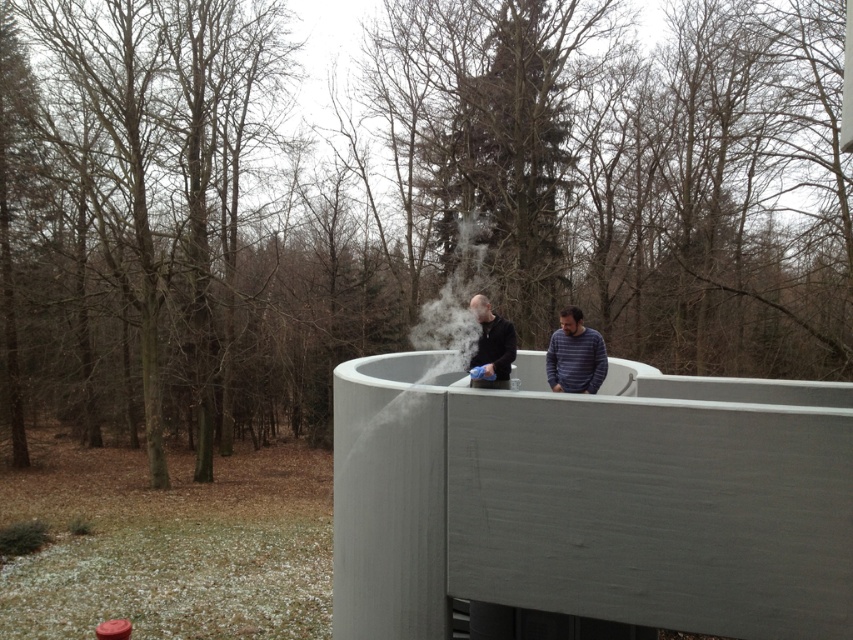
Question: Among these objects, which one is nearest to the camera?

Choices:
 (A) brown leafless tree at left
 (B) striped cotton shirt at center

Answer: (B)

Question: Which point is closer to the camera taking this photo?

Choices:
 (A) (498, 333)
 (B) (595, 346)
 (C) (460, 250)

Answer: (A)

Question: Does matte black clothing at center appear under striped cotton shirt at center?

Choices:
 (A) yes
 (B) no

Answer: (B)

Question: Does striped cotton shirt at center have a greater width compared to matte black jacket at center?

Choices:
 (A) no
 (B) yes

Answer: (B)

Question: Which object is closer to the camera taking this photo?

Choices:
 (A) white vapor at center
 (B) striped cotton shirt at center
 (C) matte black clothing at center

Answer: (A)

Question: Does striped cotton shirt at center have a smaller size compared to matte black jacket at center?

Choices:
 (A) no
 (B) yes

Answer: (A)